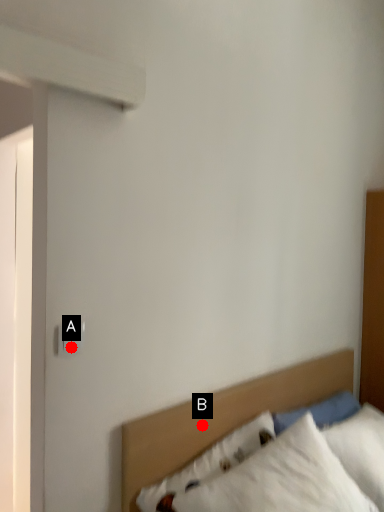
Question: Two points are circled on the image, labeled by A and B beside each circle. Which point appears closest to the camera in this image?

Choices:
 (A) A is closer
 (B) B is closer

Answer: (A)